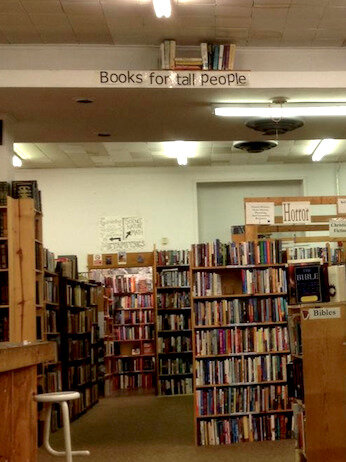
Where is `ceiling`? ceiling is located at coordinates (71, 161), (290, 155).